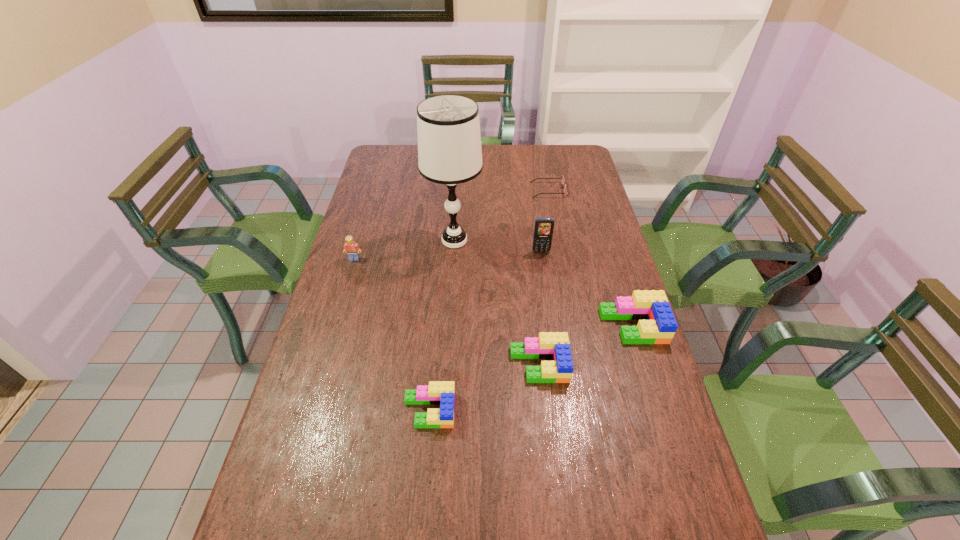
With all Legos evenly spaced, where should an extra Lego be placed on the left to continue the pattern? Please point out a vacant space. Please provide its 2D coordinates. Your answer should be formatted as a tuple, i.e. [(x, y)], where the tuple contains the x and y coordinates of a point satisfying the conditions above.

[(299, 464)]